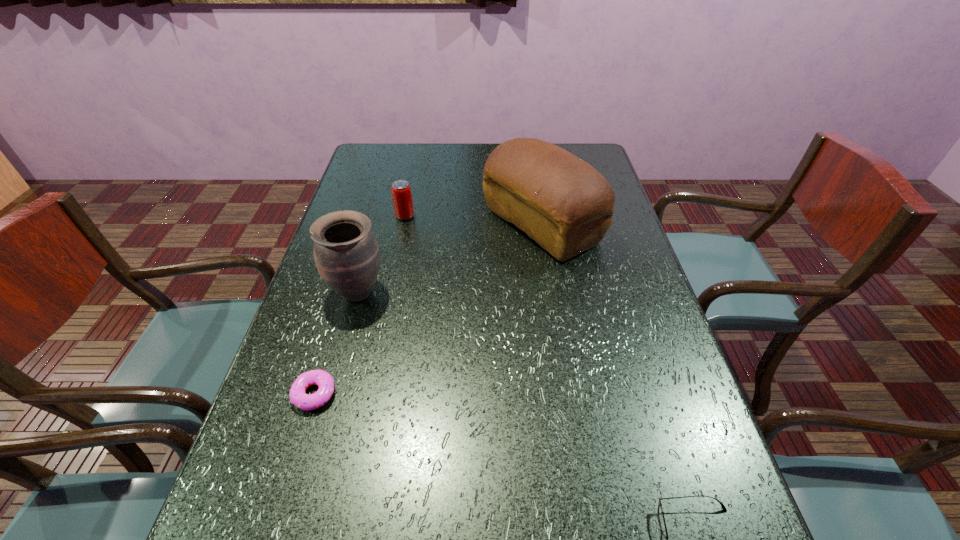
Where is `bread`? The height and width of the screenshot is (540, 960). bread is located at coordinates (560, 201).

Where is `urn`? urn is located at coordinates (346, 253).

You are a GUI agent. You are given a task and a screenshot of the screen. Output one action in this format:
    pyautogui.click(x=<x>, y=<y>)
    Task: Click on the beer can
    Image resolution: width=960 pixels, height=540 pixels.
    Given the screenshot: What is the action you would take?
    pyautogui.click(x=401, y=192)

You are a GUI agent. You are given a task and a screenshot of the screen. Output one action in this format:
    pyautogui.click(x=<x>, y=<y>)
    Task: Click on the second nearest object
    This screenshot has height=540, width=960.
    Given the screenshot: What is the action you would take?
    (324, 380)

Locate an element on the screen. vacant point located on the left of the bread is located at coordinates (366, 225).

Identify the location of vacant space located 0.230m on the back of the urn. (378, 219).

This screenshot has height=540, width=960. I want to click on free space located 0.260m on the right of the third tallest object, so click(x=501, y=216).

The height and width of the screenshot is (540, 960). I want to click on vacant region located 0.240m on the right of the doughnut, so click(455, 394).

Locate an element on the screen. The width and height of the screenshot is (960, 540). urn that is at the left edge is located at coordinates [346, 253].

The height and width of the screenshot is (540, 960). In order to click on doughnut located in the left edge section of the desktop in this screenshot , I will do `click(324, 380)`.